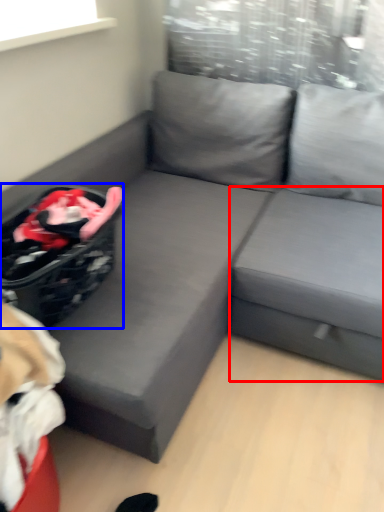
Question: Which of the following is the farthest to the observer, table (highlighted by a red box) or laundry basket (highlighted by a blue box)?

Choices:
 (A) table
 (B) laundry basket

Answer: (A)